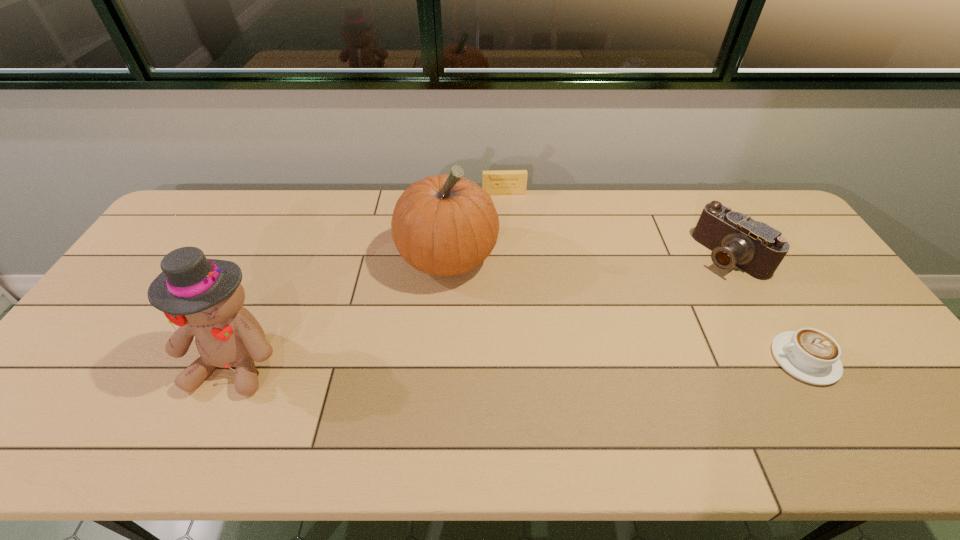
Locate an element on the screen. Image resolution: width=960 pixels, height=540 pixels. free space that is in between the camera and the shortest object is located at coordinates (766, 307).

Locate an element on the screen. Image resolution: width=960 pixels, height=540 pixels. vacant space that's between the cappuccino and the farthest object is located at coordinates [655, 276].

Locate an element on the screen. unoccupied area between the leftmost object and the second shortest object is located at coordinates (371, 276).

At what (x,y) coordinates should I click in order to perform the action: click on vacant area that lies between the cappuccino and the third tallest object. Please return your answer as a coordinate pair (x, y). Looking at the image, I should click on (766, 307).

The height and width of the screenshot is (540, 960). In order to click on free spot between the cappuccino and the videotape in this screenshot , I will do `click(655, 276)`.

Find the location of a particular element. free area in between the shortest object and the pumpkin is located at coordinates (626, 308).

Identify the location of free area in between the shortest object and the pumpkin. (626, 308).

Select which object is the fourth closest to the pumpkin. Please provide its 2D coordinates. Your answer should be formatted as a tuple, i.e. [(x, y)], where the tuple contains the x and y coordinates of a point satisfying the conditions above.

[(810, 355)]

Identify which object is the closest to the cappuccino. Please provide its 2D coordinates. Your answer should be formatted as a tuple, i.e. [(x, y)], where the tuple contains the x and y coordinates of a point satisfying the conditions above.

[(735, 239)]

Locate an element on the screen. The height and width of the screenshot is (540, 960). free region that satisfies the following two spatial constraints: 1. on the front side of the shortest object; 2. with the handle on the right side of the camera is located at coordinates 788,359.